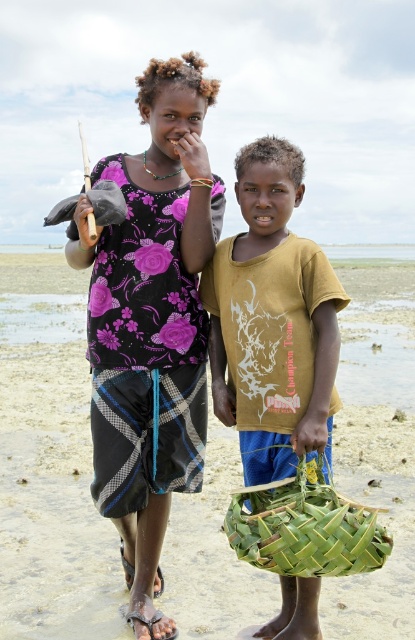
You are a photographer standing on the beach and want to take a photo of both the green woven basket at center and the green woven basket at lower center in the same frame. Considering their distance apart, can you fit both baskets into your camera view without moving either basket?

The green woven basket at center is 2.37 meters away from the green woven basket at lower center. Depending on your camera lens and zoom settings, it might be possible to capture both baskets in one frame if the camera can accommodate a 2.37 meter span within its field of view.

You are a photographer trying to capture a clear shot of the purple floral shirt at center and the brown woven sandal at lower center. If you want to ensure both objects are fully visible in your frame, which object should you position closer to the edge of the frame to avoid cropping?

The purple floral shirt at center might be wider than brown woven sandal at lower center, so positioning the brown woven sandal at lower center closer to the edge would be better to ensure both are fully visible.